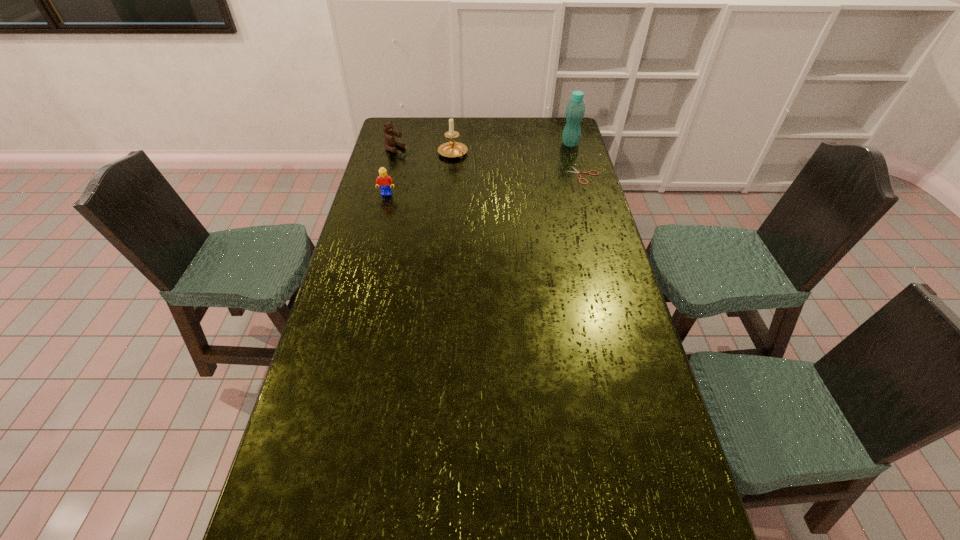
The width and height of the screenshot is (960, 540). I want to click on empty space that is in between the third object from left to right and the teddy bear, so (424, 151).

Where is `vacant region between the teddy bear and the water bottle`? vacant region between the teddy bear and the water bottle is located at coordinates (483, 146).

Locate an element on the screen. Image resolution: width=960 pixels, height=540 pixels. empty space that is in between the teddy bear and the nearest object is located at coordinates (391, 171).

Identify the location of free space between the third object from right to left and the fourth farthest object. The height and width of the screenshot is (540, 960). (518, 165).

Find the location of a particular element. The width and height of the screenshot is (960, 540). blank region between the fourth shortest object and the teddy bear is located at coordinates (424, 151).

Find the location of a particular element. free space that is in between the shears and the teddy bear is located at coordinates (489, 162).

Locate an element on the screen. The width and height of the screenshot is (960, 540). free space between the teddy bear and the shears is located at coordinates (489, 162).

What are the coordinates of `free space between the nearest object and the second nearest object` in the screenshot? It's located at (485, 185).

Select which object appears as the closest to the water bottle. Please provide its 2D coordinates. Your answer should be formatted as a tuple, i.e. [(x, y)], where the tuple contains the x and y coordinates of a point satisfying the conditions above.

[(577, 171)]

The width and height of the screenshot is (960, 540). Identify the location of object that is the third nearest to the fourth shortest object. (577, 171).